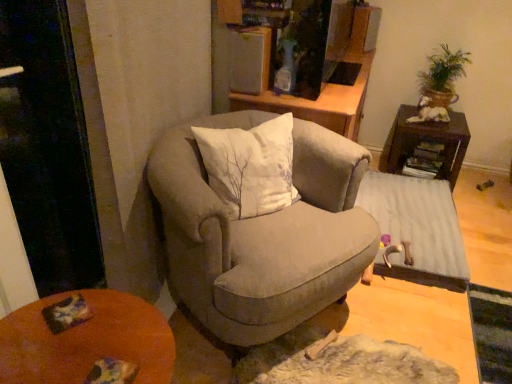
Looking at this image, what is the approximate height of dark brown wood side table at right, the 1th table when ordered from top to bottom?

The height of dark brown wood side table at right, the 1th table when ordered from top to bottom, is 16.42 inches.

Describe the element at coordinates (86, 341) in the screenshot. I see `orange wooden desk at lower left` at that location.

What do you see at coordinates (417, 229) in the screenshot? Image resolution: width=512 pixels, height=384 pixels. I see `wooden textured table at lower right, marked as the 2th table in a top-to-bottom arrangement` at bounding box center [417, 229].

The height and width of the screenshot is (384, 512). I want to click on white ceramic dog at upper right, so tap(429, 112).

Image resolution: width=512 pixels, height=384 pixels. What do you see at coordinates (443, 76) in the screenshot?
I see `green leafy plant at upper right` at bounding box center [443, 76].

This screenshot has width=512, height=384. I want to click on dark brown wood side table at right, the second table in the bottom-to-top sequence, so click(426, 141).

Based on their sizes in the image, would you say wooden textured table at lower right, marked as the 1th table in a bottom-to-top arrangement, is bigger or smaller than green leafy plant at upper right?

Considering their sizes, wooden textured table at lower right, marked as the 1th table in a bottom-to-top arrangement, takes up more space than green leafy plant at upper right.

Considering the sizes of objects wooden textured table at lower right, marked as the 2th table in a top-to-bottom arrangement, and green leafy plant at upper right in the image provided, who is wider, wooden textured table at lower right, marked as the 2th table in a top-to-bottom arrangement, or green leafy plant at upper right?

wooden textured table at lower right, marked as the 2th table in a top-to-bottom arrangement.

Considering the sizes of objects green leafy plant at upper right and orange wooden desk at lower left in the image provided, who is shorter, green leafy plant at upper right or orange wooden desk at lower left?

Standing shorter between the two is green leafy plant at upper right.

Is green leafy plant at upper right in front of or behind orange wooden desk at lower left in the image?

Clearly, green leafy plant at upper right is behind orange wooden desk at lower left.

Considering the sizes of green leafy plant at upper right and orange wooden desk at lower left in the image, is green leafy plant at upper right wider or thinner than orange wooden desk at lower left?

Considering their sizes, green leafy plant at upper right looks slimmer than orange wooden desk at lower left.

Between point (15, 316) and point (201, 304), which one is positioned in front?

The point (15, 316) is closer to the camera.

Considering the sizes of objects orange wooden desk at lower left and velvet beige armchair at center in the image provided, who is smaller, orange wooden desk at lower left or velvet beige armchair at center?

orange wooden desk at lower left is smaller.

Is orange wooden desk at lower left located outside velvet beige armchair at center?

→ Yes, orange wooden desk at lower left is not within velvet beige armchair at center.

How different are the orientations of white ceramic dog at upper right and dark brown wood side table at right, the 1th table when ordered from top to bottom, in degrees?

white ceramic dog at upper right and dark brown wood side table at right, the 1th table when ordered from top to bottom, are facing 61.2 degrees away from each other.

Which is more to the right, white ceramic dog at upper right or dark brown wood side table at right, the second table in the bottom-to-top sequence?

dark brown wood side table at right, the second table in the bottom-to-top sequence.

Considering the sizes of objects white ceramic dog at upper right and dark brown wood side table at right, the 1th table when ordered from top to bottom, in the image provided, who is wider, white ceramic dog at upper right or dark brown wood side table at right, the 1th table when ordered from top to bottom,?

Wider between the two is dark brown wood side table at right, the 1th table when ordered from top to bottom.

Between white ceramic dog at upper right and dark brown wood side table at right, the 1th table when ordered from top to bottom, which one has less height?

white ceramic dog at upper right is shorter.

Is dark brown wood side table at right, the 1th table when ordered from top to bottom, to the left or to the right of velvet beige armchair at center in the image?

From the image, it's evident that dark brown wood side table at right, the 1th table when ordered from top to bottom, is to the right of velvet beige armchair at center.

Is velvet beige armchair at center located within dark brown wood side table at right, the second table in the bottom-to-top sequence?

Definitely not — velvet beige armchair at center is not inside dark brown wood side table at right, the second table in the bottom-to-top sequence.

Looking at this image, from the image's perspective, relative to velvet beige armchair at center, is dark brown wood side table at right, the 1th table when ordered from top to bottom, above or below?

dark brown wood side table at right, the 1th table when ordered from top to bottom, is above velvet beige armchair at center.

Can you confirm if dark brown wood side table at right, the second table in the bottom-to-top sequence, is shorter than velvet beige armchair at center?

→ Correct, dark brown wood side table at right, the second table in the bottom-to-top sequence, is not as tall as velvet beige armchair at center.

Does orange wooden desk at lower left have a smaller size compared to green leafy plant at upper right?

Actually, orange wooden desk at lower left might be larger than green leafy plant at upper right.

Is orange wooden desk at lower left in front of or behind green leafy plant at upper right in the image?

Visually, orange wooden desk at lower left is located in front of green leafy plant at upper right.

Would you say green leafy plant at upper right is part of orange wooden desk at lower left's contents?

No, orange wooden desk at lower left does not contain green leafy plant at upper right.

Is point (91, 333) closer to viewer compared to point (420, 82)?

That is True.

Is dark brown wood side table at right, the 1th table when ordered from top to bottom, oriented towards orange wooden desk at lower left?

Yes, dark brown wood side table at right, the 1th table when ordered from top to bottom, is turned towards orange wooden desk at lower left.

What's the angular difference between dark brown wood side table at right, the second table in the bottom-to-top sequence, and orange wooden desk at lower left's facing directions?

92.7 degrees.

Image resolution: width=512 pixels, height=384 pixels. Find the location of `desk in front of the dark brown wood side table at right, the 1th table when ordered from top to bottom`. desk in front of the dark brown wood side table at right, the 1th table when ordered from top to bottom is located at coordinates (86, 341).

Identify the location of houseplant behind the wooden textured table at lower right, marked as the 2th table in a top-to-bottom arrangement. The image size is (512, 384). (443, 76).

Where is `houseplant on the right of orange wooden desk at lower left`? houseplant on the right of orange wooden desk at lower left is located at coordinates (443, 76).

Looking at the image, which one is located closer to green leafy plant at upper right, velvet beige armchair at center or wooden textured table at lower right, marked as the 1th table in a bottom-to-top arrangement?

wooden textured table at lower right, marked as the 1th table in a bottom-to-top arrangement, is positioned closer to the anchor green leafy plant at upper right.

Based on their spatial positions, is orange wooden desk at lower left or velvet beige armchair at center closer to dark brown wood side table at right, the 1th table when ordered from top to bottom?

velvet beige armchair at center lies closer to dark brown wood side table at right, the 1th table when ordered from top to bottom, than the other object.

From the image, which object appears to be nearer to velvet beige armchair at center, green leafy plant at upper right or wooden textured table at lower right, marked as the 1th table in a bottom-to-top arrangement?

Among the two, wooden textured table at lower right, marked as the 1th table in a bottom-to-top arrangement, is located nearer to velvet beige armchair at center.

Which object lies further to the anchor point velvet beige armchair at center, white ceramic dog at upper right or wooden textured table at lower right, marked as the 1th table in a bottom-to-top arrangement?

white ceramic dog at upper right.

When comparing their distances from green leafy plant at upper right, does wooden textured table at lower right, marked as the 2th table in a top-to-bottom arrangement, or velvet beige armchair at center seem closer?

wooden textured table at lower right, marked as the 2th table in a top-to-bottom arrangement, lies closer to green leafy plant at upper right than the other object.

Considering their positions, is velvet beige armchair at center positioned further to white ceramic dog at upper right than green leafy plant at upper right?

Based on the image, velvet beige armchair at center appears to be further to white ceramic dog at upper right.

When comparing their distances from orange wooden desk at lower left, does dark brown wood side table at right, the 1th table when ordered from top to bottom, or white ceramic dog at upper right seem closer?

Among the two, dark brown wood side table at right, the 1th table when ordered from top to bottom, is located nearer to orange wooden desk at lower left.

Considering their positions, is dark brown wood side table at right, the second table in the bottom-to-top sequence, positioned closer to green leafy plant at upper right than white ceramic dog at upper right?

white ceramic dog at upper right lies closer to green leafy plant at upper right than the other object.

Locate an element on the screen. Image resolution: width=512 pixels, height=384 pixels. table between velvet beige armchair at center and dark brown wood side table at right, the 1th table when ordered from top to bottom, in the front-back direction is located at coordinates (417, 229).

Locate an element on the screen. animal between green leafy plant at upper right and dark brown wood side table at right, the second table in the bottom-to-top sequence, in the up-down direction is located at coordinates (429, 112).

Where is `table between wooden textured table at lower right, marked as the 2th table in a top-to-bottom arrangement, and white ceramic dog at upper right, along the z-axis`? This screenshot has height=384, width=512. table between wooden textured table at lower right, marked as the 2th table in a top-to-bottom arrangement, and white ceramic dog at upper right, along the z-axis is located at coordinates (426, 141).

The image size is (512, 384). I want to click on chair positioned between orange wooden desk at lower left and white ceramic dog at upper right from near to far, so pyautogui.click(x=262, y=234).